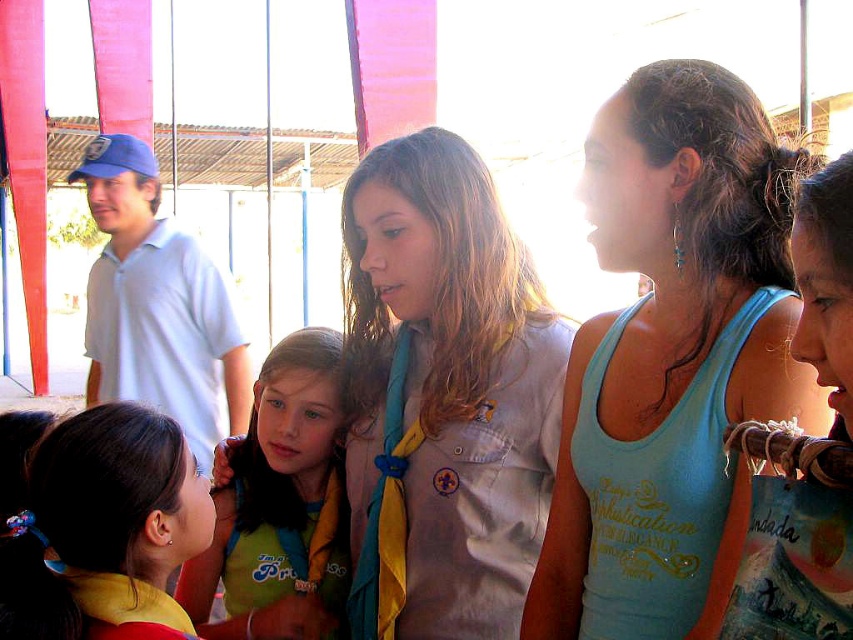
You are organizing a costume party and need to ensure that all outfits fit through a narrow doorway. Given the light brown fabric uniform at center and the green jersey at center, which outfit is wider and thus might require more caution when moving through the doorway?

The light brown fabric uniform at center is wider than the green jersey at center, so it might require more caution when moving through the doorway.